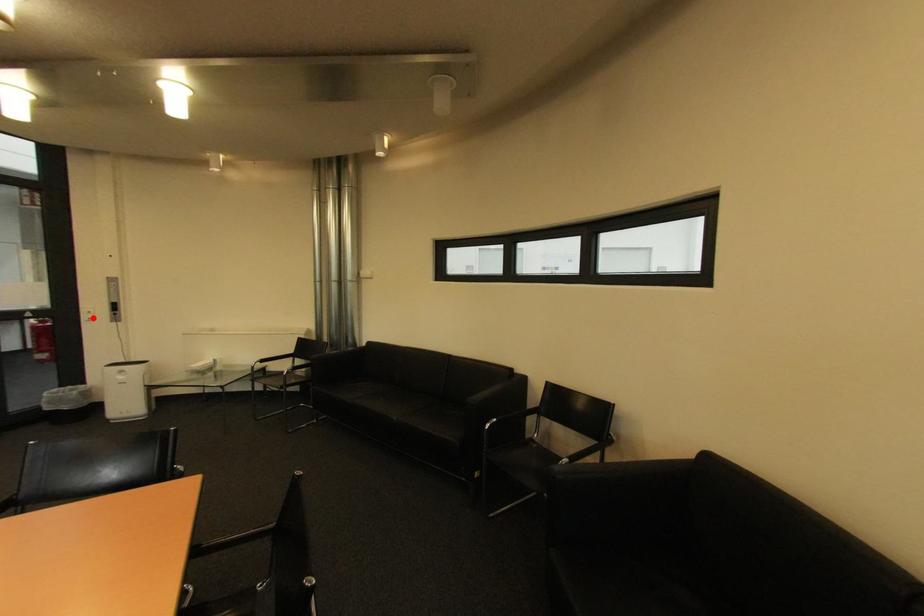
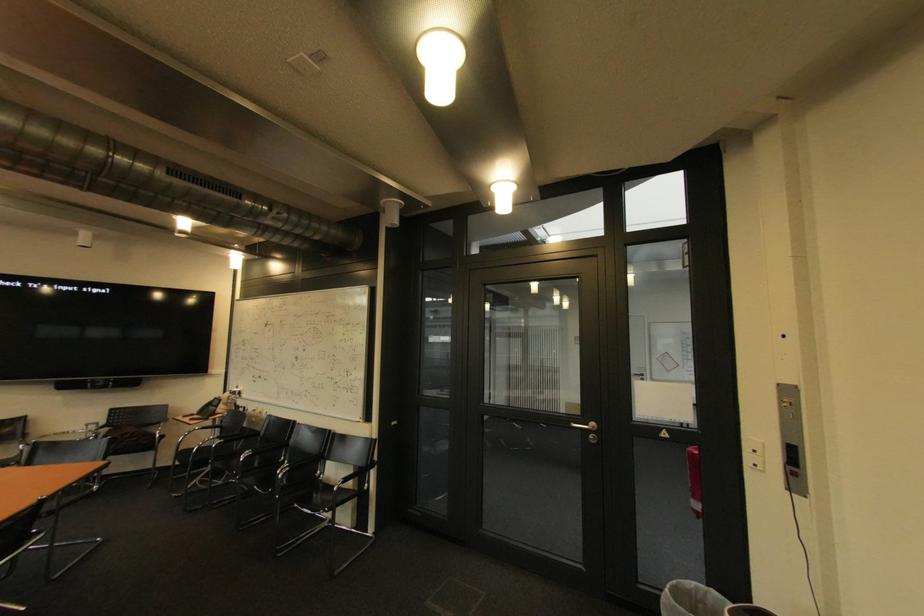
The point at the highlighted location is marked in the first image. Where is the corresponding point in the second image?

(757, 459)